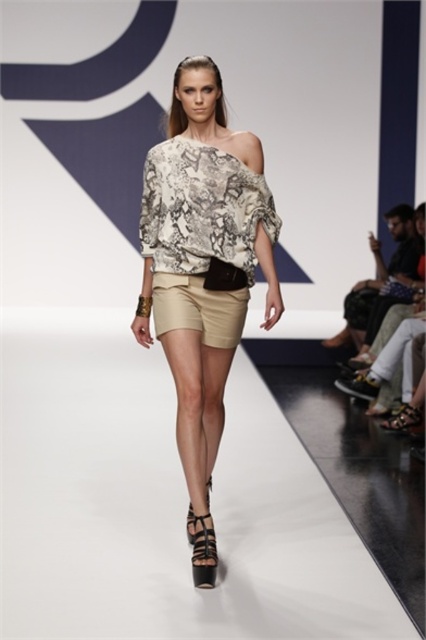
Question: Which object is the closest to the printed fabric blouse at center?

Choices:
 (A) snake print fabric top at center
 (B) leather/textured sandal at lower center
 (C) leather textured sandal at lower right
 (D) black leather sandal at center

Answer: (A)

Question: Which of the following is the farthest from the observer?

Choices:
 (A) (190, 541)
 (B) (196, 547)

Answer: (A)

Question: In this image, where is black leather sandal at center located relative to leather/textured sandal at lower center?

Choices:
 (A) above
 (B) below

Answer: (B)

Question: Is printed fabric blouse at center above black leather sandal at center?

Choices:
 (A) yes
 (B) no

Answer: (A)

Question: Does printed fabric blouse at center have a smaller size compared to black leather sandal at center?

Choices:
 (A) no
 (B) yes

Answer: (A)

Question: Which of the following is the farthest from the observer?

Choices:
 (A) (196, 570)
 (B) (198, 236)
 (C) (187, 304)

Answer: (C)